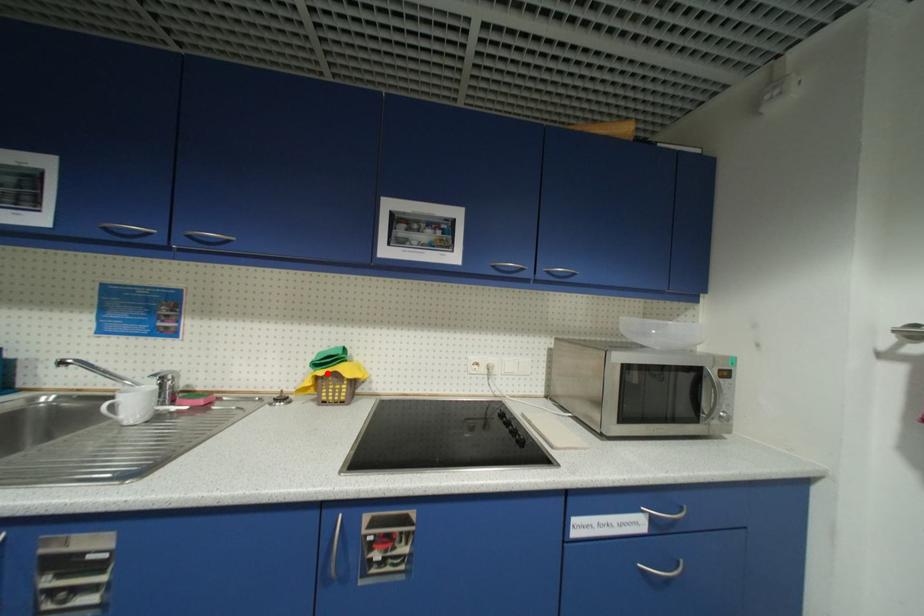
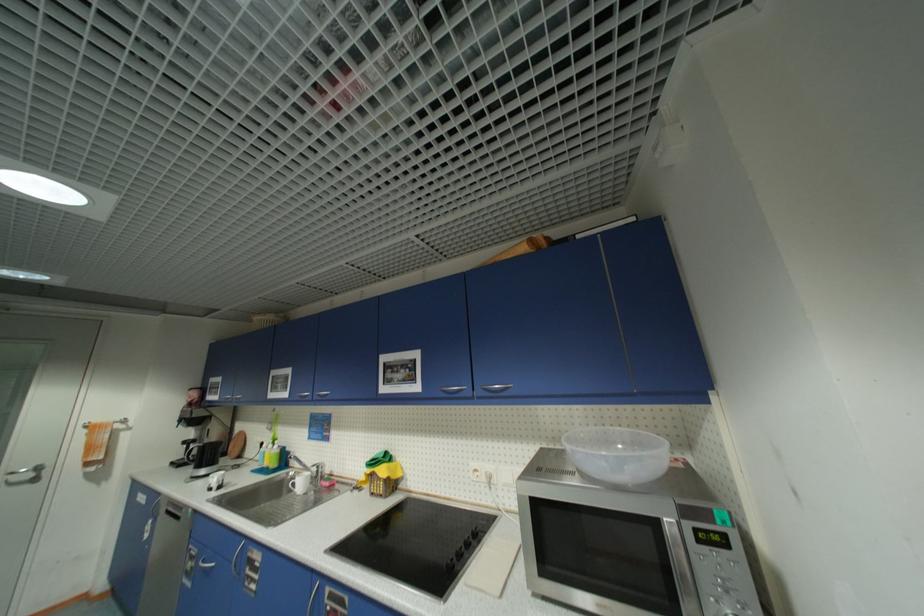
Locate, in the second image, the point that corresponds to the highlighted location in the first image.

(374, 472)